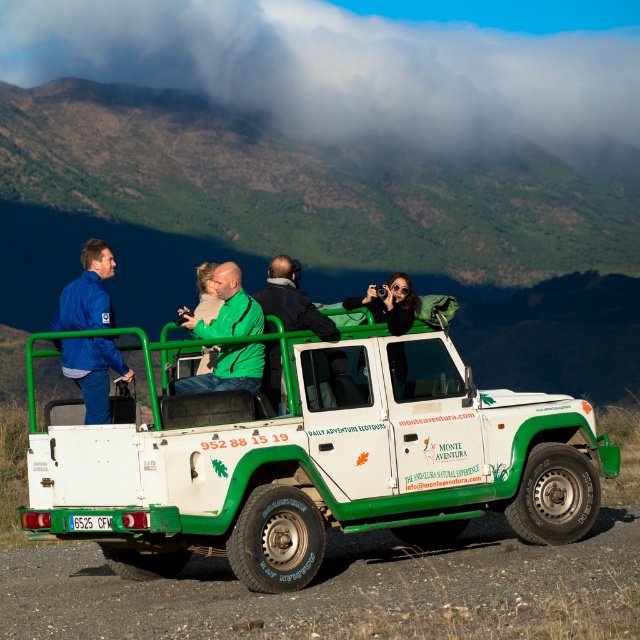
Can you confirm if white matte jeep at center is smaller than blue matte jacket at left?

Yes, white matte jeep at center is smaller than blue matte jacket at left.

Is white matte jeep at center above blue matte jacket at left?

No, white matte jeep at center is not above blue matte jacket at left.

Image resolution: width=640 pixels, height=640 pixels. I want to click on white matte jeep at center, so click(x=317, y=464).

Is green matte vehicle at center to the left of blue matte jacket at left from the viewer's perspective?

In fact, green matte vehicle at center is to the right of blue matte jacket at left.

This screenshot has height=640, width=640. I want to click on green matte vehicle at center, so (x=320, y=227).

Find the location of a particular element. The image size is (640, 640). green matte vehicle at center is located at coordinates (320, 227).

From the picture: Can you confirm if green matte vehicle at center is shorter than dark green jacket at center?

No, green matte vehicle at center is not shorter than dark green jacket at center.

Is point (410, 252) farther from viewer compared to point (262, 301)?

Yes, point (410, 252) is farther from viewer.

Locate an element on the screen. green matte vehicle at center is located at coordinates (320, 227).

Identify the location of green matte vehicle at center. (320, 227).